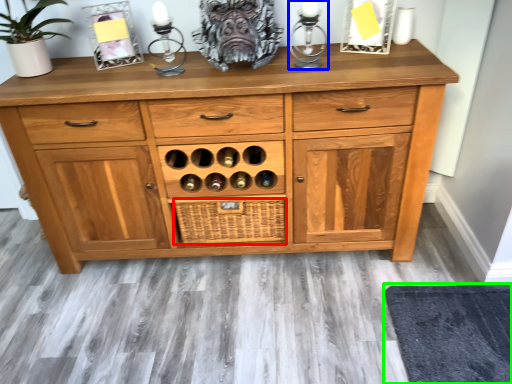
Question: Estimate the real-world distances between objects in this image. Which object is closer to crate (highlighted by a red box), candle holder (highlighted by a blue box) or mat (highlighted by a green box)?

Choices:
 (A) candle holder
 (B) mat

Answer: (A)